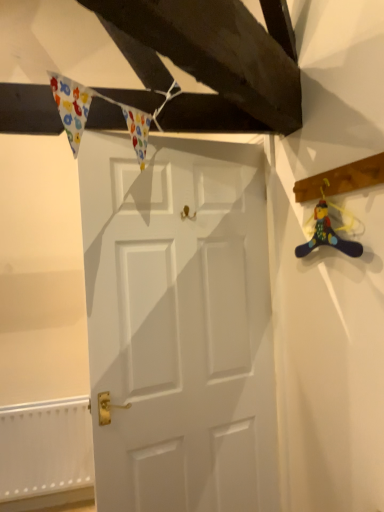
Question: Is white textured radiator at lower left with matte plastic toy at right?

Choices:
 (A) no
 (B) yes

Answer: (A)

Question: Is white textured radiator at lower left at the left side of matte plastic toy at right?

Choices:
 (A) no
 (B) yes

Answer: (B)

Question: Considering the relative sizes of white textured radiator at lower left and matte plastic toy at right in the image provided, is white textured radiator at lower left bigger than matte plastic toy at right?

Choices:
 (A) no
 (B) yes

Answer: (B)

Question: Is white textured radiator at lower left smaller than matte plastic toy at right?

Choices:
 (A) no
 (B) yes

Answer: (A)

Question: Is matte plastic toy at right completely or partially inside white textured radiator at lower left?

Choices:
 (A) no
 (B) yes

Answer: (A)

Question: From the image's perspective, is white textured radiator at lower left located above or below matte plastic toy at right?

Choices:
 (A) below
 (B) above

Answer: (A)

Question: From a real-world perspective, is white textured radiator at lower left positioned above or below matte plastic toy at right?

Choices:
 (A) above
 (B) below

Answer: (B)

Question: Considering the positions of white textured radiator at lower left and matte plastic toy at right in the image, is white textured radiator at lower left taller or shorter than matte plastic toy at right?

Choices:
 (A) tall
 (B) short

Answer: (A)

Question: In the image, is white textured radiator at lower left positioned in front of or behind matte plastic toy at right?

Choices:
 (A) behind
 (B) front

Answer: (A)

Question: In terms of height, does white textured radiator at lower left look taller or shorter compared to white matte door at center?

Choices:
 (A) tall
 (B) short

Answer: (B)

Question: Looking at the image, does white textured radiator at lower left seem bigger or smaller compared to white matte door at center?

Choices:
 (A) big
 (B) small

Answer: (B)

Question: Looking at their shapes, would you say white textured radiator at lower left is wider or thinner than white matte door at center?

Choices:
 (A) wide
 (B) thin

Answer: (A)

Question: Does point (72, 467) appear closer or farther from the camera than point (218, 349)?

Choices:
 (A) closer
 (B) farther

Answer: (B)

Question: Relative to white textured radiator at lower left, is matte plastic toy at right in front or behind?

Choices:
 (A) behind
 (B) front

Answer: (B)

Question: In terms of size, does matte plastic toy at right appear bigger or smaller than white textured radiator at lower left?

Choices:
 (A) small
 (B) big

Answer: (A)